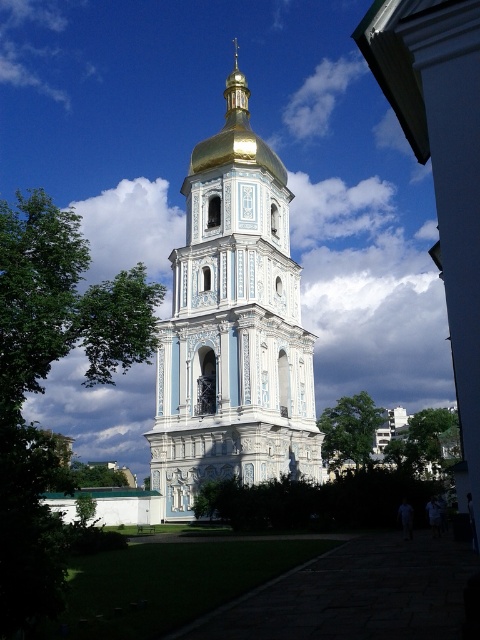
Question: Can you confirm if green leafy tree at left is wider than green leafy tree at lower left?

Choices:
 (A) no
 (B) yes

Answer: (B)

Question: Considering the relative positions of blue glazed tiles at center and green leafy tree at left in the image provided, where is blue glazed tiles at center located with respect to green leafy tree at left?

Choices:
 (A) below
 (B) above

Answer: (B)

Question: Which object appears farthest from the camera in this image?

Choices:
 (A) blue glazed tiles at center
 (B) green leafy tree at lower left
 (C) green leafy tree at left
 (D) green leafy tree at center

Answer: (B)

Question: Is blue glazed tiles at center smaller than green leafy tree at center?

Choices:
 (A) yes
 (B) no

Answer: (B)

Question: Which point appears farthest from the camera in this image?

Choices:
 (A) (109, 481)
 (B) (347, 445)
 (C) (108, 316)
 (D) (279, 268)

Answer: (A)

Question: Which is farther from the green leafy tree at left?

Choices:
 (A) blue glazed tiles at center
 (B) green leafy tree at lower left

Answer: (B)